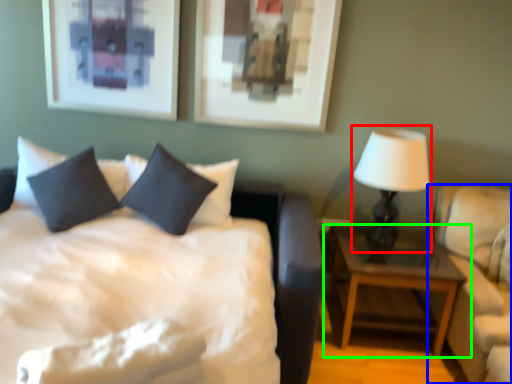
Question: Which object is positioned closest to table lamp (highlighted by a red box)? Select from studio couch (highlighted by a blue box) and nightstand (highlighted by a green box).

Choices:
 (A) studio couch
 (B) nightstand

Answer: (A)